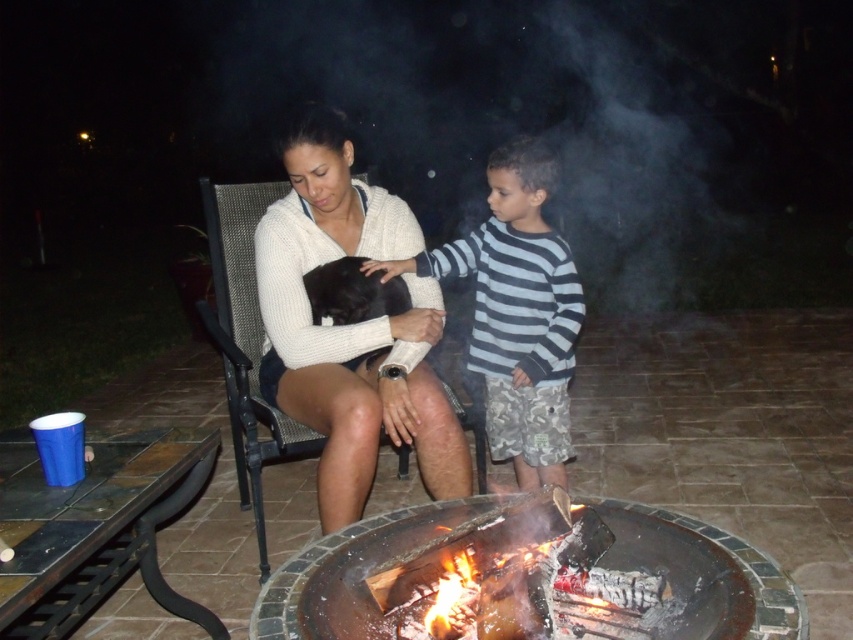
Does striped cotton shirt at center come behind charcoal gray stone fire pit at center?

Yes, striped cotton shirt at center is further from the viewer.

Who is more forward, (508, 440) or (790, 593)?

Point (790, 593)

Identify the location of striped cotton shirt at center. The image size is (853, 640). (x=517, y=310).

Who is taller, white knit sweater at center or charcoal gray stone fire pit at center?

white knit sweater at center is taller.

Is point (291, 324) less distant than point (320, 541)?

That is False.

Who is more distant from viewer, (x=271, y=365) or (x=422, y=504)?

The point (x=271, y=365) is behind.

Find the location of a particular element. white knit sweater at center is located at coordinates (347, 326).

Is white knit sweater at center wider than striped cotton shirt at center?

Incorrect, white knit sweater at center's width does not surpass striped cotton shirt at center's.

Does white knit sweater at center have a lesser width compared to striped cotton shirt at center?

Yes.

Between point (422, 384) and point (547, 401), which one is positioned behind?

The point (547, 401) is more distant.

Where is `white knit sweater at center`? white knit sweater at center is located at coordinates (347, 326).